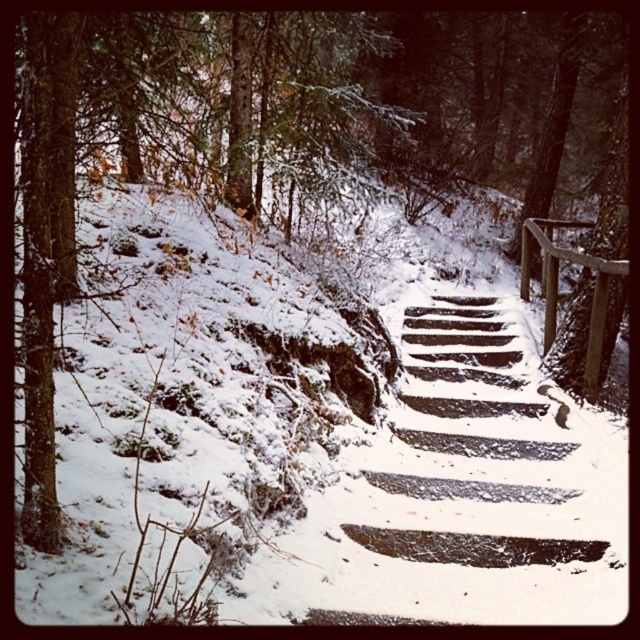
You are standing at the base of the wooden steps covered in snow in the winter forest scene. You want to reach a specific point marked at coordinates point [564,410]. Given that the distance between you and this point is 17.59 feet, can you estimate how far you need to walk to reach it?

The distance between you and the point [564,410] is 17.59 feet, so you need to walk approximately 17.59 feet to reach it.